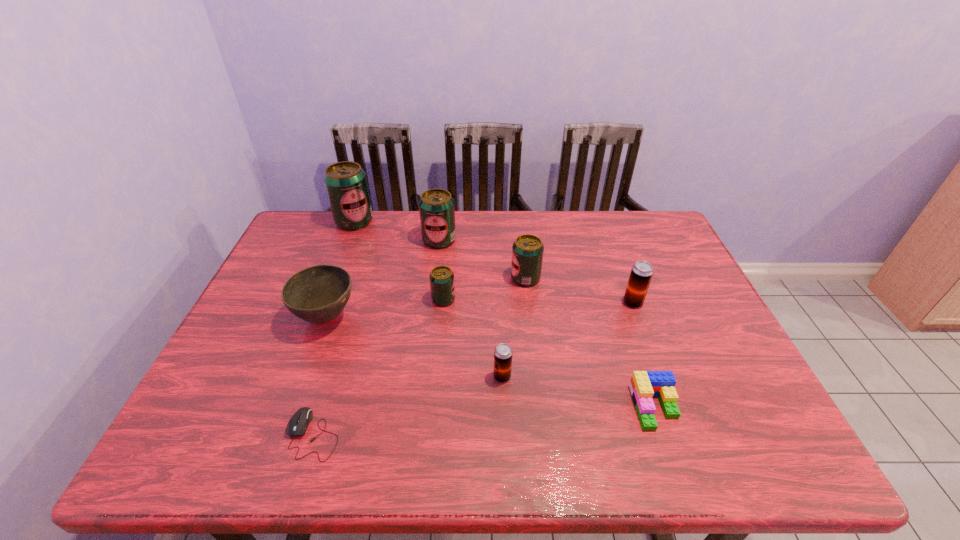
Locate an element on the screen. the third nearest object is located at coordinates (503, 353).

This screenshot has height=540, width=960. Find the location of `the fourth object from right to left`. the fourth object from right to left is located at coordinates (503, 353).

Where is `green Lego`? This screenshot has height=540, width=960. green Lego is located at coordinates (643, 385).

This screenshot has height=540, width=960. Find the location of `the second shortest object`. the second shortest object is located at coordinates (643, 385).

I want to click on computer mouse, so click(297, 425).

Identify the location of vacant space situated on the front of the biggest green beer can. (337, 266).

Locate an element on the screen. This screenshot has width=960, height=540. vacant space situated 0.110m on the left of the eighth shortest object is located at coordinates (389, 240).

In order to click on free space located 0.260m on the left of the right black beer can in this screenshot , I will do `click(529, 302)`.

Identify the location of vacant region located on the front of the second nearest green beer can. (540, 395).

Find the location of a particular element. free spot located 0.100m on the left of the bowl is located at coordinates (257, 318).